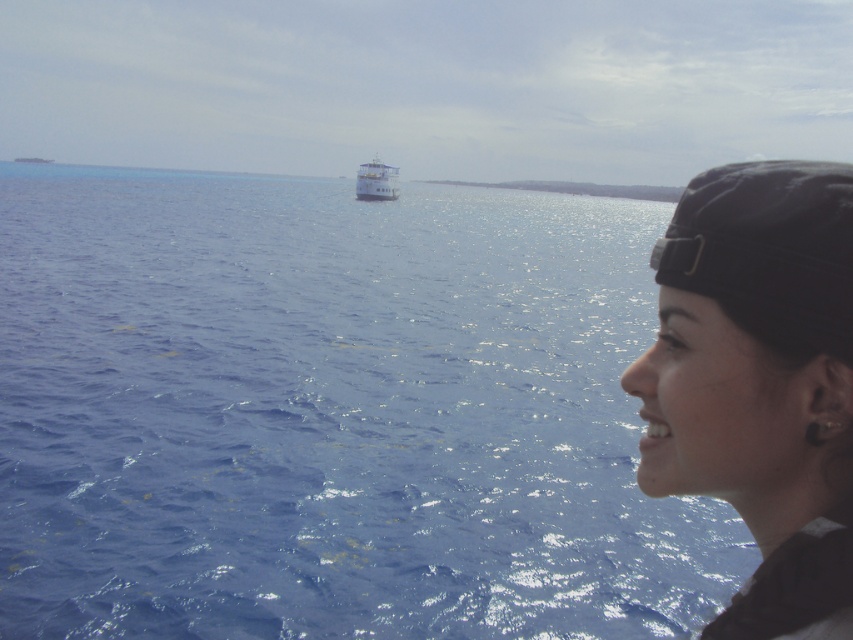
You are a photographer trying to capture the white glossy boat at center and the black matte headband at right in the same frame. Which object should you adjust your camera focus to first if you want to ensure both are in focus?

The black matte headband at right is shorter than the white glossy boat at center, so you should focus on the white glossy boat at center first to ensure both objects are within the depth of field.

You are a photographer standing at the edge of the water. You want to take a photo of the black matte headband at right and the blue glossy water at center. How far apart are these two objects in the scene?

The blue glossy water at center is 32.35 meters from the black matte headband at right, so the distance between them is 32.35 meters.

You are standing on the shore looking at the seascape. Where is the blue glossy water at center located in terms of coordinates?

The blue glossy water at center is located at coordinates point (332,413).